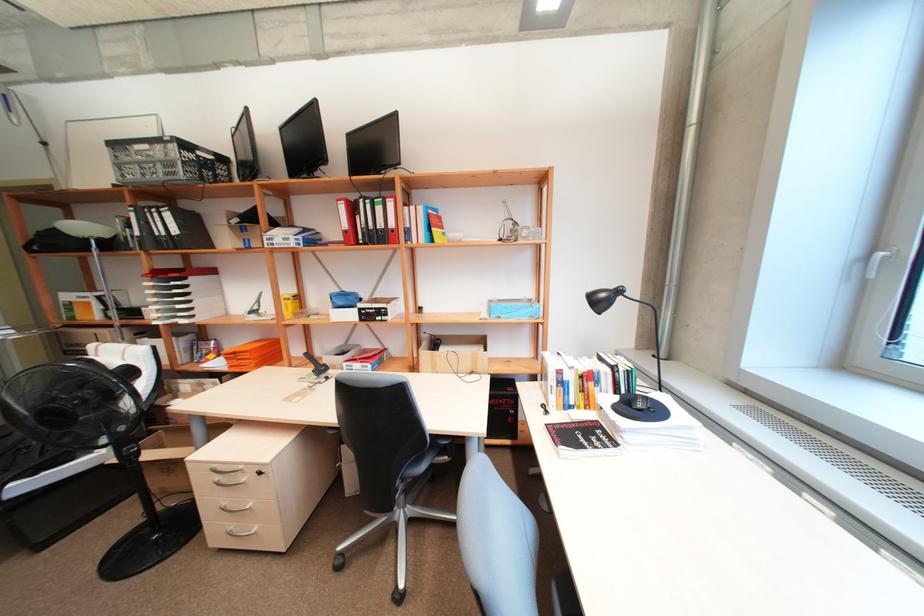
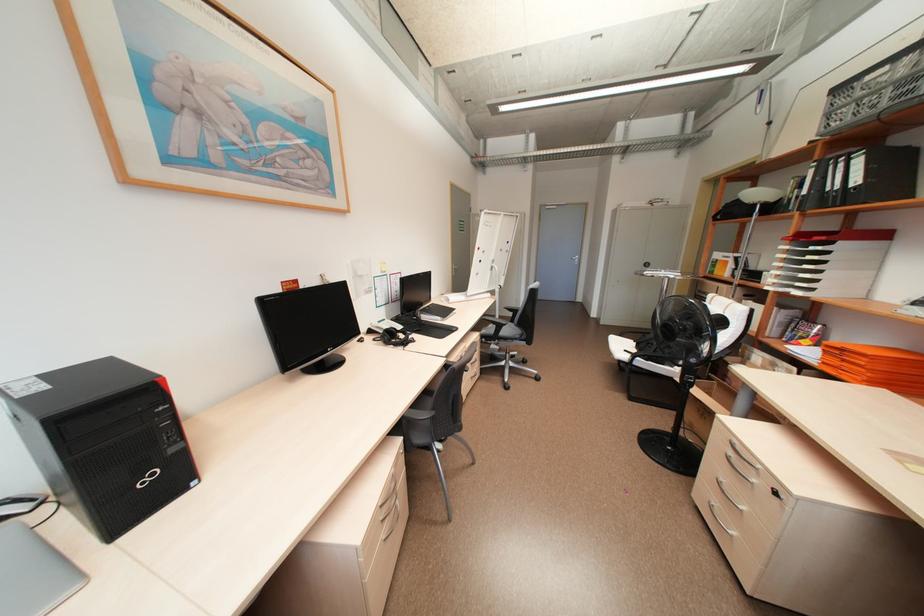
Question: I am providing you with two images of the same scene from different viewpoints. Which of the following objects are not visible in image2?

Choices:
 (A) black chair armrest
 (B) black binder
 (C) metal door handle
 (D) none of these

Answer: (D)